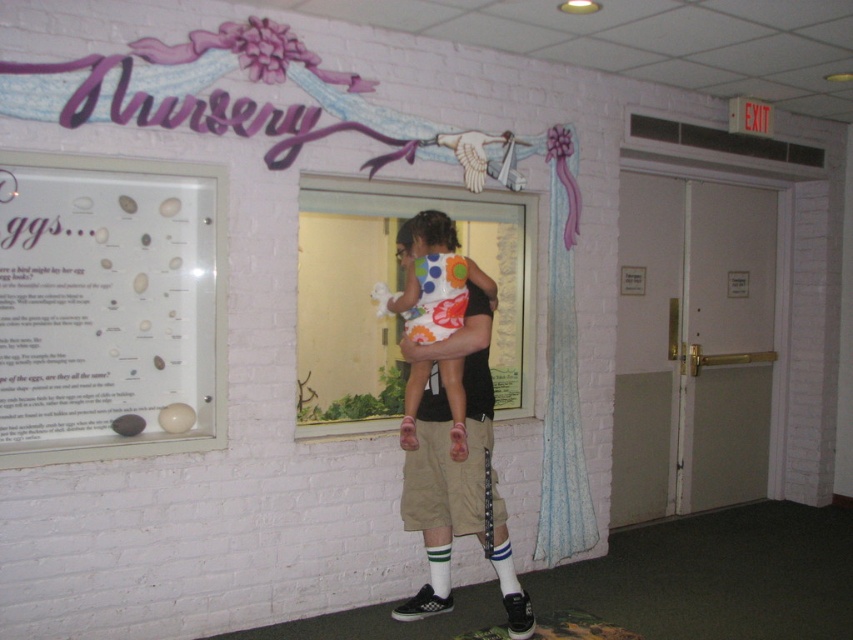
You are a fashion designer trying to create a new outfit. You have two options for the bottom part of the outfit. The khaki shorts at center and the polka dot fabric dress at center. Which one is wider at the waist area?

The khaki shorts at center might be wider than the polka dot fabric dress at center, so the khaki shorts at center is the wider option for the waist area.

You are a museum visitor who wants to see the matte glass display case at left and the khaki shorts at center. Since you can only focus on one object at a time, which object should you look at first if you want to view the wider object?

The matte glass display case at left is wider than the khaki shorts at center, so you should look at the matte glass display case at left first.